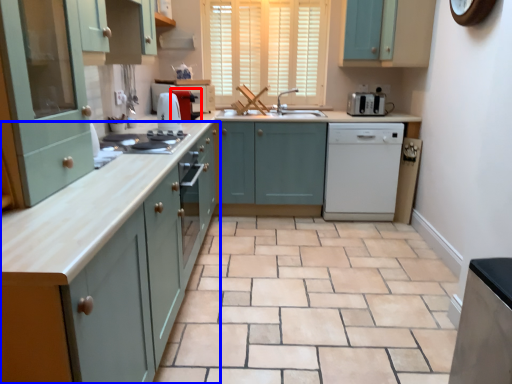
Question: Which point is further to the camera, coffee machine (highlighted by a red box) or cabinetry (highlighted by a blue box)?

Choices:
 (A) coffee machine
 (B) cabinetry

Answer: (A)